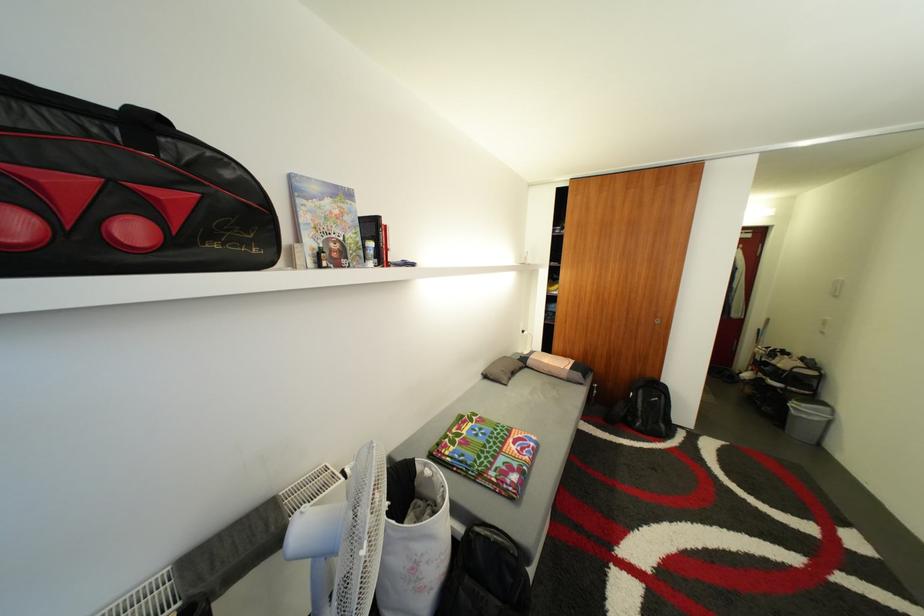
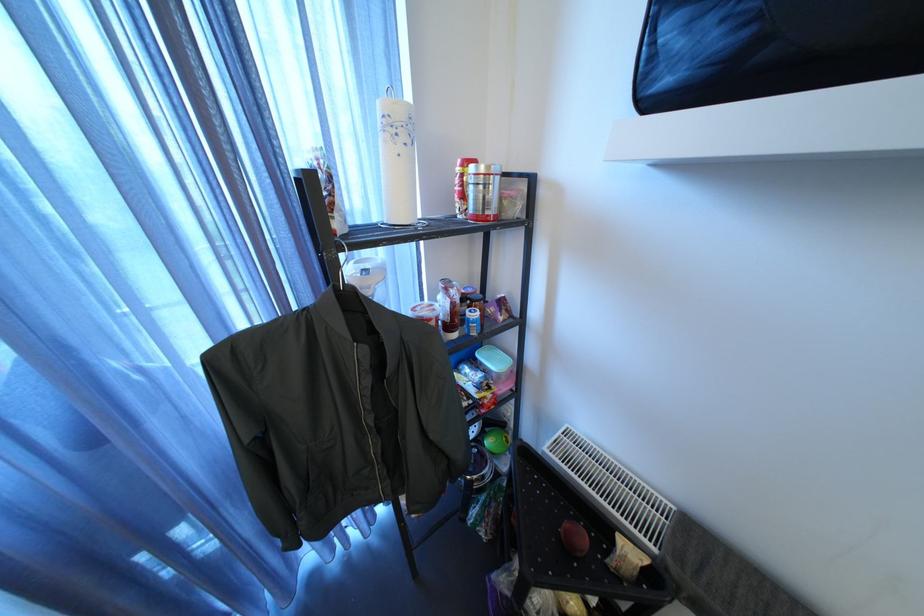
How did the camera likely rotate?

The camera rotated toward left-down.